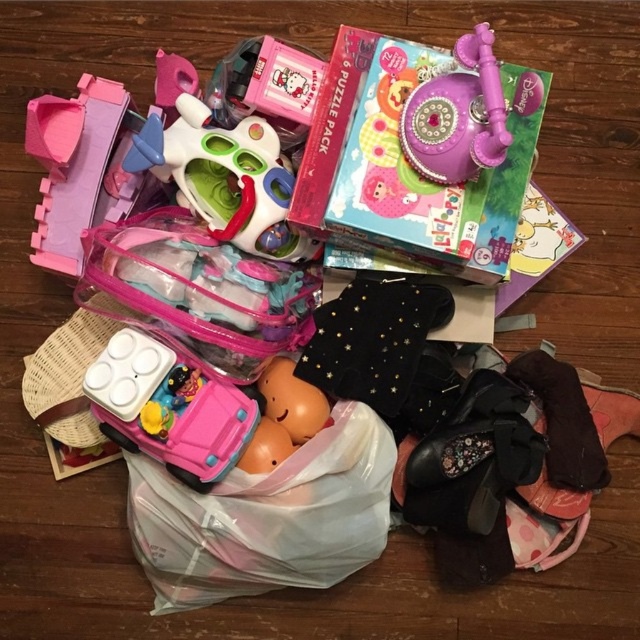
You are a parent trying to organize the toys. You have a storage box that can only fit items narrower than 20 cm. You see the translucent plastic toy car at center and the translucent plastic toy at center. Which one can fit into the storage box?

The translucent plastic toy car at center has a width less than the translucent plastic toy at center, so the translucent plastic toy car at center can fit into the storage box if its width is under 20 cm. However, without knowing the exact width of the toy car, we cannot confirm. Please check the toy car width against the box limit.

You are a parent trying to organize the toys. You see the translucent plastic toy car at center and the translucent plastic toy at center. Which one is positioned lower in the image?

The translucent plastic toy car at center is positioned below the translucent plastic toy at center, so it is lower in the image.